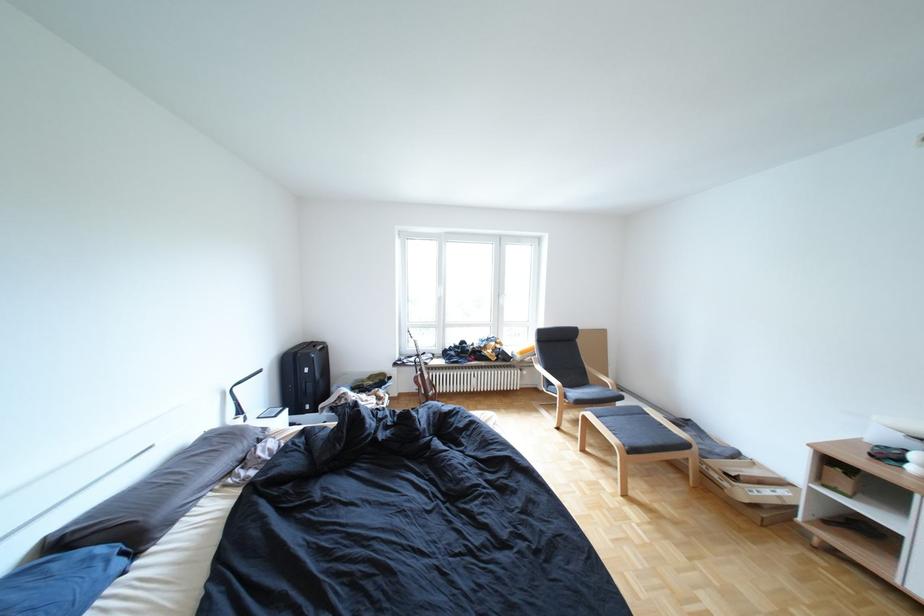
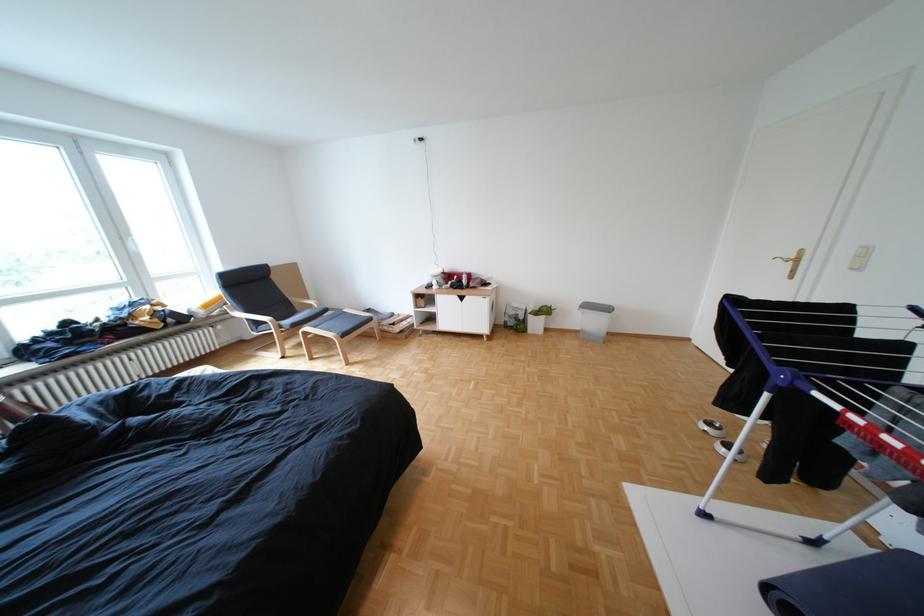
The first image is from the beginning of the video and the second image is from the end. How did the camera likely rotate when shooting the video?

The camera rotated toward right-down.